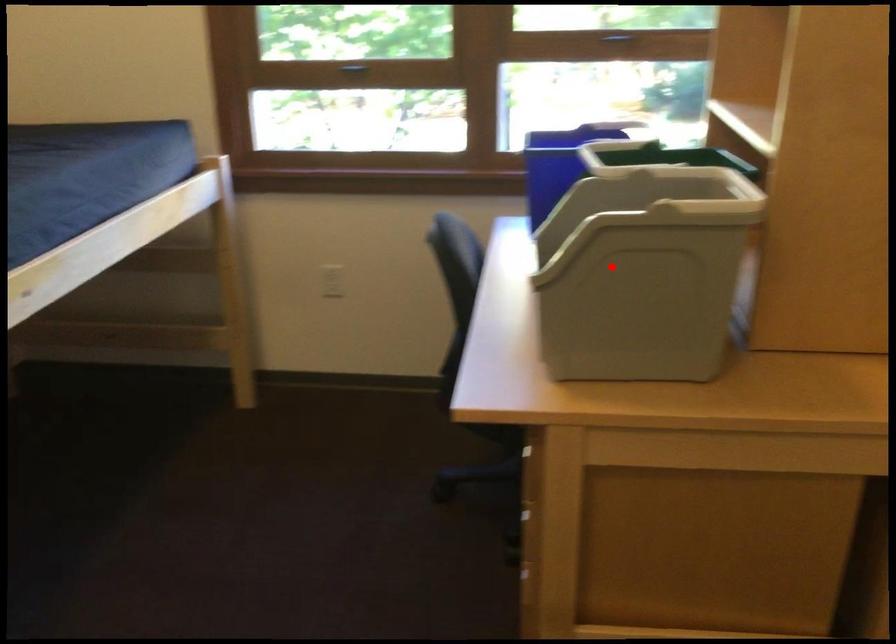
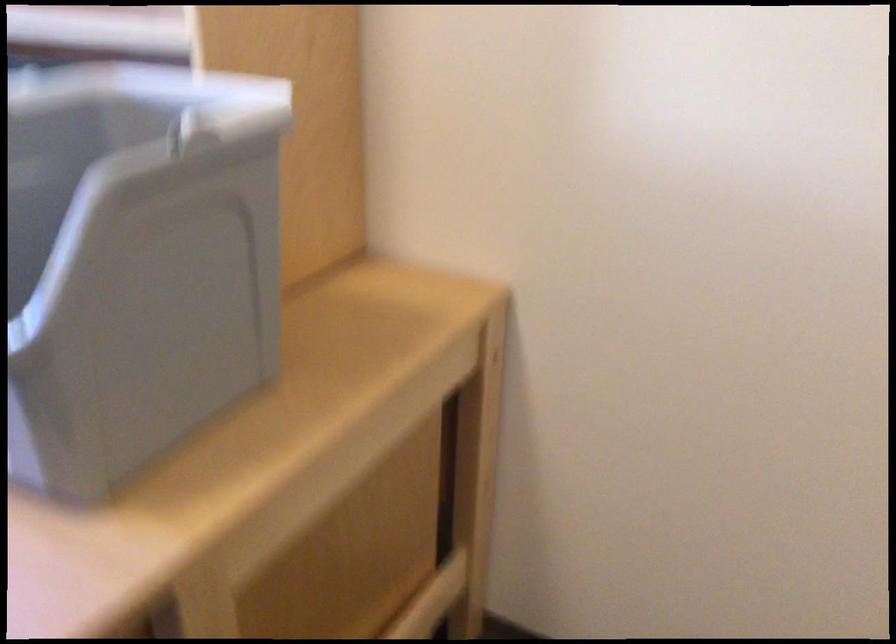
Where in the second image is the point corresponding to the highlighted location from the first image?

(135, 263)